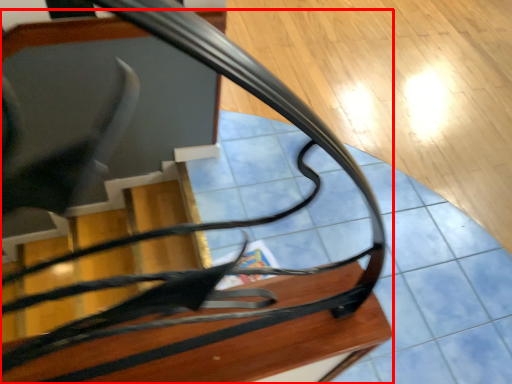
Question: From the image, what is the correct spatial relationship of furniture (annotated by the red box) in relation to table?

Choices:
 (A) right
 (B) left

Answer: (A)